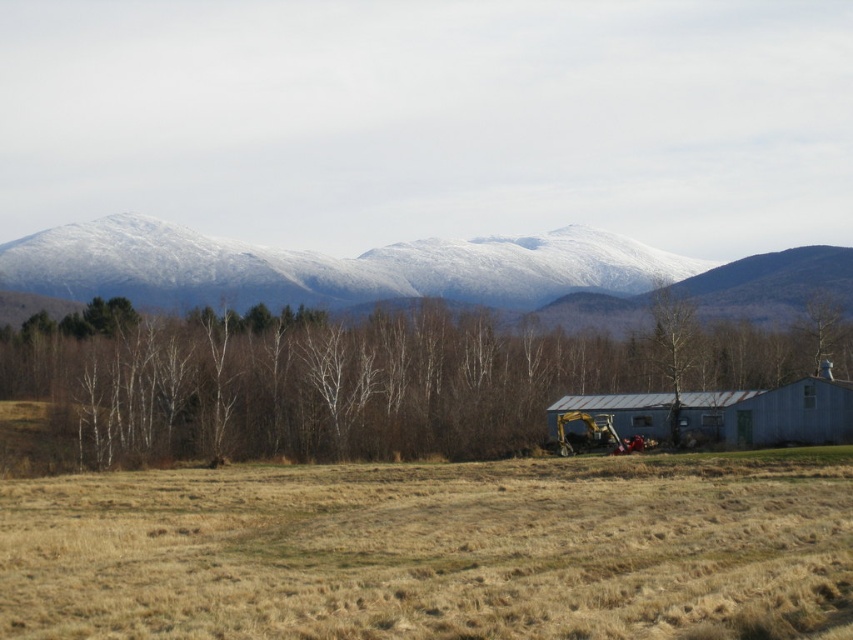
You are a hiker planning to cross the brown grassy field at lower center and the smooth white tree at center. Which path would allow you to walk further without encountering obstacles?

The brown grassy field at lower center has a larger width than the smooth white tree at center, so walking across the brown grassy field at lower center would allow you to go further without obstacles.